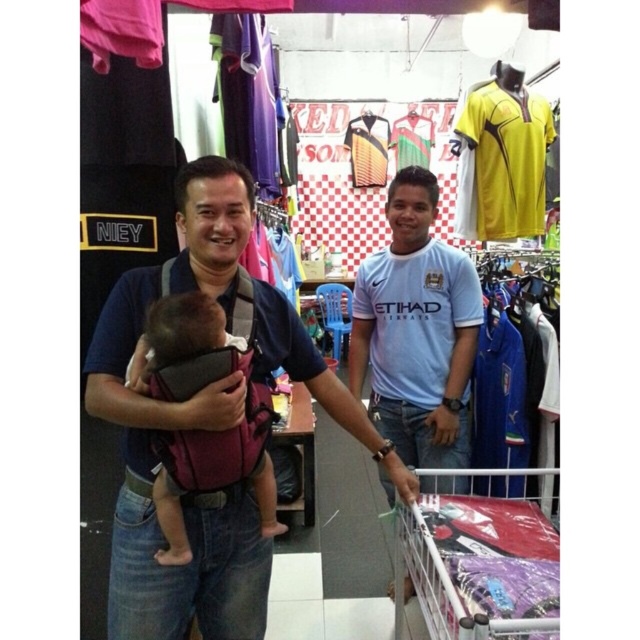
What are the exact coordinates of the maroon fabric baby carrier at center in the image?

The maroon fabric baby carrier at center is located at coordinates 0.783 on the x axis and 0.286 on the y axis.

Based on the photo, you are a customer in the store and want to know which item is placed higher between the maroon fabric baby carrier at center and the light blue jersey at center. According to the scene description, which one is higher?

The light blue jersey at center is higher than the maroon fabric baby carrier at center because the maroon fabric baby carrier at center is below it.

You are standing in a sports apparel store and want to take a photo of the point at coordinates point (422, 172). If your camera has a maximum focus range of 2 meters, will it be able to focus on that point?

The point (422, 172) is 2.05 meters from the camera, which is slightly beyond the maximum focus range of 2 meters. Therefore, the camera may not be able to focus on that point.